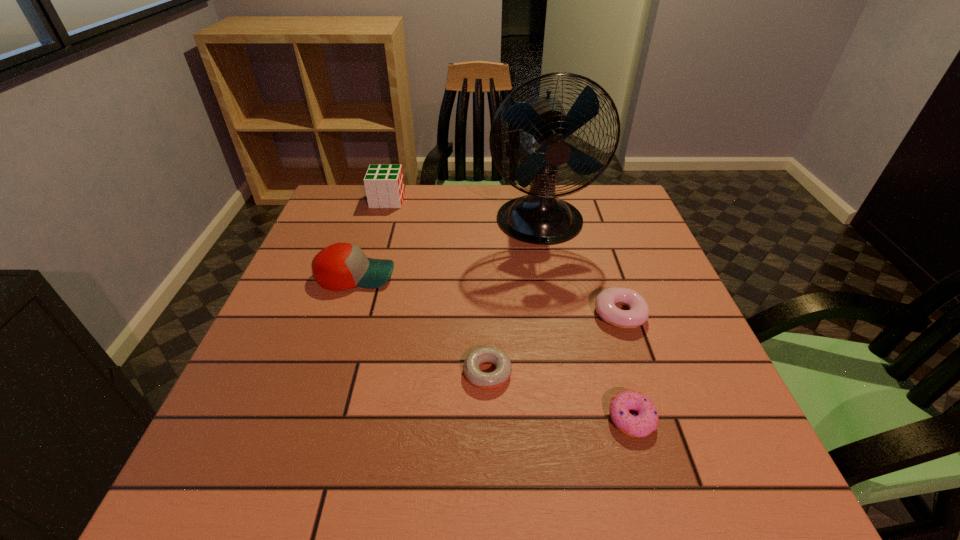
Locate an element on the screen. The width and height of the screenshot is (960, 540). object that is at the far left corner is located at coordinates (384, 184).

Where is `object that is positioned at the far right corner`? This screenshot has height=540, width=960. object that is positioned at the far right corner is located at coordinates (540, 217).

Find the location of a particular element. vacant space at the far edge is located at coordinates (403, 200).

Where is `vacant space at the near edge`? Image resolution: width=960 pixels, height=540 pixels. vacant space at the near edge is located at coordinates (460, 487).

The width and height of the screenshot is (960, 540). What are the coordinates of `vacant space at the left edge of the desktop` in the screenshot? It's located at (318, 242).

The height and width of the screenshot is (540, 960). Identify the location of vacant space at the right edge of the desktop. (649, 343).

At what (x,y) coordinates should I click in order to perform the action: click on blank region between the third tallest object and the tallest object. Please return your answer as a coordinate pair (x, y). The width and height of the screenshot is (960, 540). Looking at the image, I should click on (448, 249).

Find the location of `vacant region between the fan and the farthest doughnut`. vacant region between the fan and the farthest doughnut is located at coordinates (580, 269).

Locate an element on the screen. Image resolution: width=960 pixels, height=540 pixels. vacant space in between the nearest object and the leftmost doughnut is located at coordinates pyautogui.click(x=560, y=396).

Where is `vacant area between the cube and the third tallest object`? vacant area between the cube and the third tallest object is located at coordinates (372, 238).